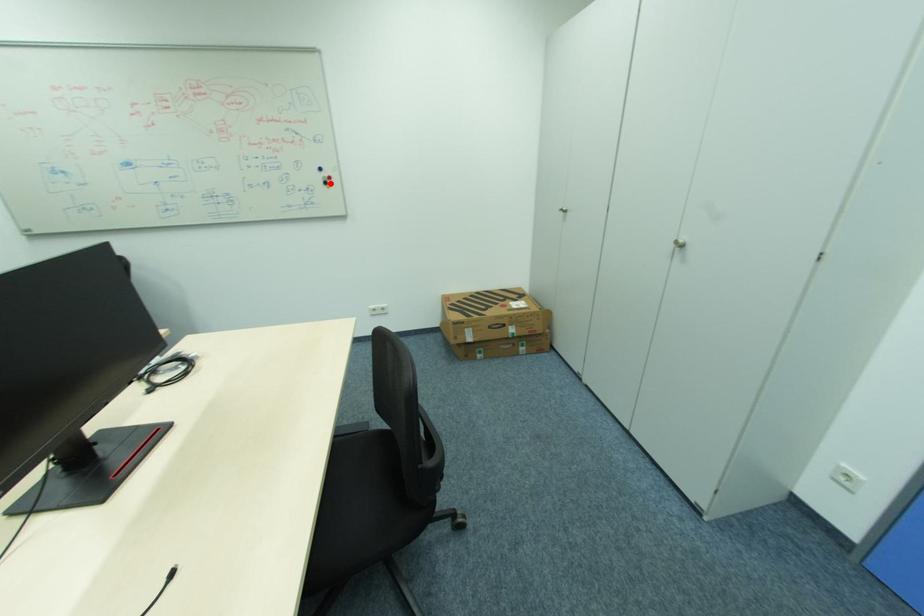
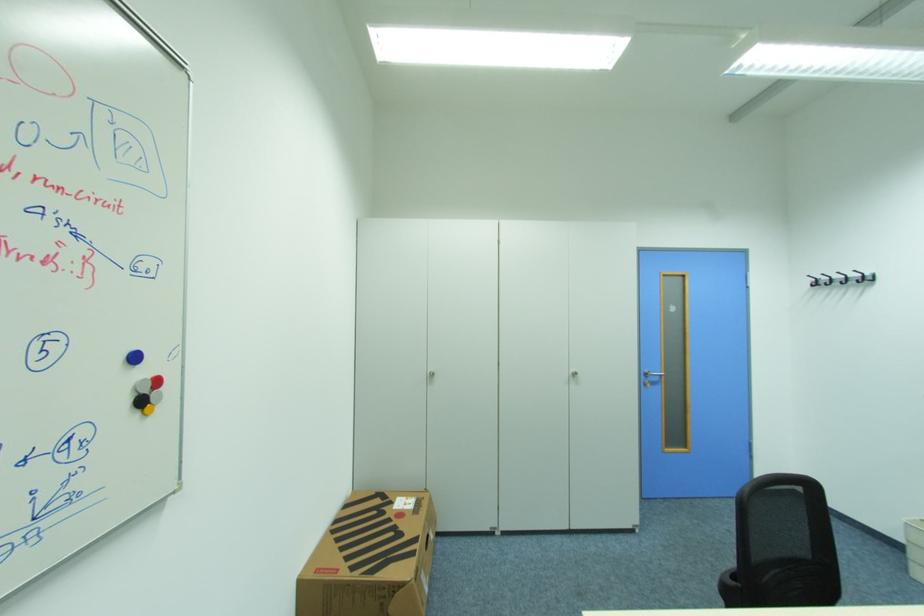
Where in the second image is the point corresponding to the highlighted location from the first image?

(146, 403)